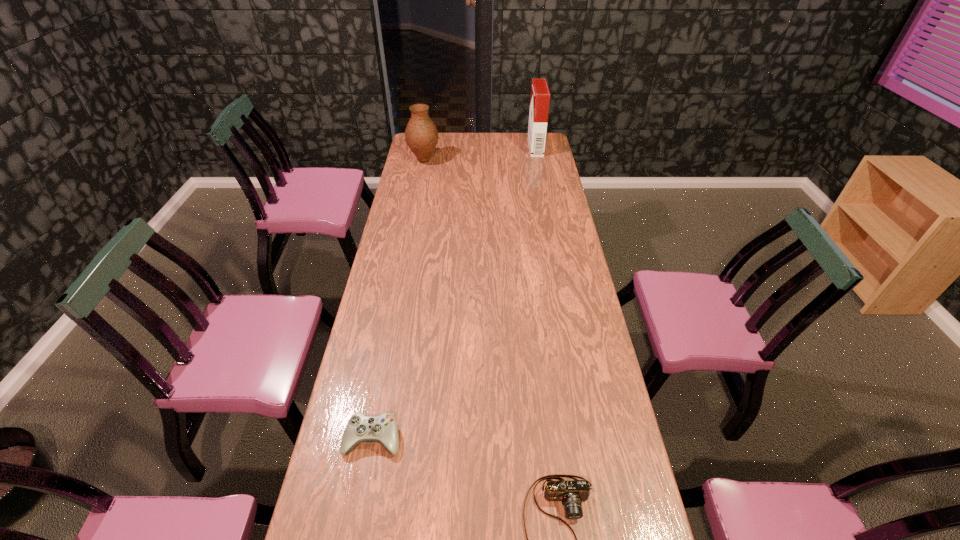
Find the location of `vacant space that satisfies the following two spatial constraints: 1. on the front side of the second tallest object; 2. on the left side of the second nearest object`. vacant space that satisfies the following two spatial constraints: 1. on the front side of the second tallest object; 2. on the left side of the second nearest object is located at coordinates (372, 438).